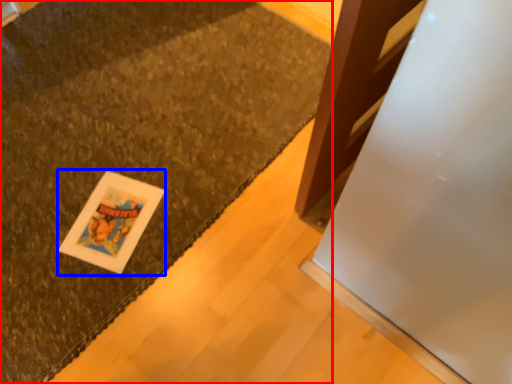
Question: Which of the following is the closest to the observer, mat (highlighted by a red box) or card (highlighted by a blue box)?

Choices:
 (A) mat
 (B) card

Answer: (A)